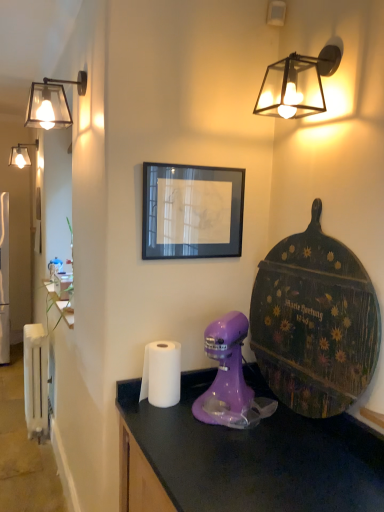
Question: Can you confirm if matte black glass lamp at upper right, marked as the 1th lamp in a right-to-left arrangement, is wider than matte glass lampshade at upper left, arranged as the second lamp when viewed from the right?

Choices:
 (A) yes
 (B) no

Answer: (B)

Question: Considering the relative positions of matte black glass lamp at upper right, which is the 1th lamp in front-to-back order, and matte glass lampshade at upper left, placed as the second lamp when sorted from left to right, in the image provided, is matte black glass lamp at upper right, which is the 1th lamp in front-to-back order, behind matte glass lampshade at upper left, placed as the second lamp when sorted from left to right,?

Choices:
 (A) no
 (B) yes

Answer: (A)

Question: Can you confirm if matte black glass lamp at upper right, which appears as the third lamp when viewed from the back, is taller than matte glass lampshade at upper left, the second lamp from the back?

Choices:
 (A) yes
 (B) no

Answer: (B)

Question: From a real-world perspective, is matte black glass lamp at upper right, marked as the 1th lamp in a right-to-left arrangement, on top of matte glass lampshade at upper left, placed as the second lamp when sorted from left to right?

Choices:
 (A) yes
 (B) no

Answer: (A)

Question: Is matte black glass lamp at upper right, which appears as the third lamp when viewed from the back, at the right side of matte glass lampshade at upper left, the second lamp from the back?

Choices:
 (A) no
 (B) yes

Answer: (B)

Question: In terms of height, does white paper towel at center look taller or shorter compared to matte black glass lamp at upper right, positioned as the third lamp in left-to-right order?

Choices:
 (A) tall
 (B) short

Answer: (A)

Question: Considering their positions, is white paper towel at center located in front of or behind matte black glass lamp at upper right, positioned as the third lamp in left-to-right order?

Choices:
 (A) front
 (B) behind

Answer: (B)

Question: Is white paper towel at center to the left or to the right of matte black glass lamp at upper right, positioned as the third lamp in left-to-right order, in the image?

Choices:
 (A) right
 (B) left

Answer: (B)

Question: Is point (150, 387) closer or farther from the camera than point (291, 64)?

Choices:
 (A) farther
 (B) closer

Answer: (A)

Question: Based on their positions, is white paper towel at center located to the left or right of matte glass lamp at upper left, positioned as the first lamp in back-to-front order?

Choices:
 (A) left
 (B) right

Answer: (B)

Question: Is white paper towel at center taller or shorter than matte glass lamp at upper left, positioned as the first lamp in back-to-front order?

Choices:
 (A) short
 (B) tall

Answer: (A)

Question: From the image's perspective, is white paper towel at center located above or below matte glass lamp at upper left, which ranks as the third lamp in front-to-back order?

Choices:
 (A) above
 (B) below

Answer: (B)

Question: Is white paper towel at center inside the boundaries of matte glass lamp at upper left, which ranks as the third lamp in front-to-back order, or outside?

Choices:
 (A) inside
 (B) outside

Answer: (B)

Question: Considering the relative positions of matte black glass lamp at upper right, positioned as the third lamp in left-to-right order, and black glass picture frame at center in the image provided, is matte black glass lamp at upper right, positioned as the third lamp in left-to-right order, to the left or to the right of black glass picture frame at center?

Choices:
 (A) right
 (B) left

Answer: (A)

Question: Based on their sizes in the image, would you say matte black glass lamp at upper right, which appears as the third lamp when viewed from the back, is bigger or smaller than black glass picture frame at center?

Choices:
 (A) big
 (B) small

Answer: (A)